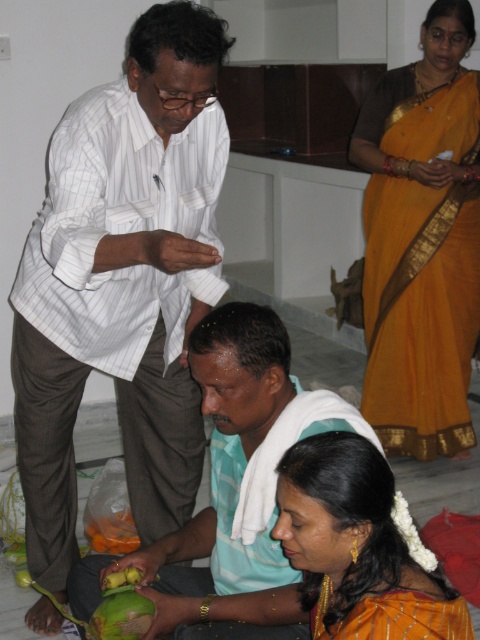
Question: Where is white striped shirt at upper left located in relation to green matte mango at lower left in the image?

Choices:
 (A) above
 (B) below

Answer: (A)

Question: Is white striped shirt at upper left positioned at the back of green matte coconut at lower center?

Choices:
 (A) yes
 (B) no

Answer: (A)

Question: Which point is closer to the camera?

Choices:
 (A) yellow silk saree at lower right
 (B) orange smooth mango at lower left
 (C) green matte mango at lower left
 (D) white striped shirt at upper left

Answer: (A)

Question: Which point is closer to the camera?

Choices:
 (A) orange smooth mango at lower left
 (B) green matte mango at lower left
 (C) orange silk saree at upper right
 (D) yellow silk saree at lower right

Answer: (D)

Question: Among these objects, which one is farthest from the camera?

Choices:
 (A) orange smooth mango at lower left
 (B) green matte coconut at lower center
 (C) yellow silk saree at lower right

Answer: (A)

Question: Is orange silk saree at upper right wider than green matte coconut at lower center?

Choices:
 (A) yes
 (B) no

Answer: (B)